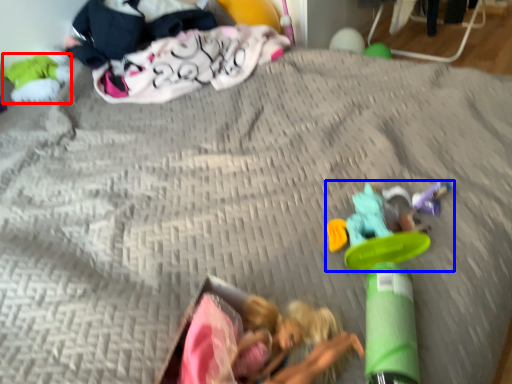
Question: Which object appears farthest to the camera in this image, toy (highlighted by a red box) or toy (highlighted by a blue box)?

Choices:
 (A) toy
 (B) toy

Answer: (A)